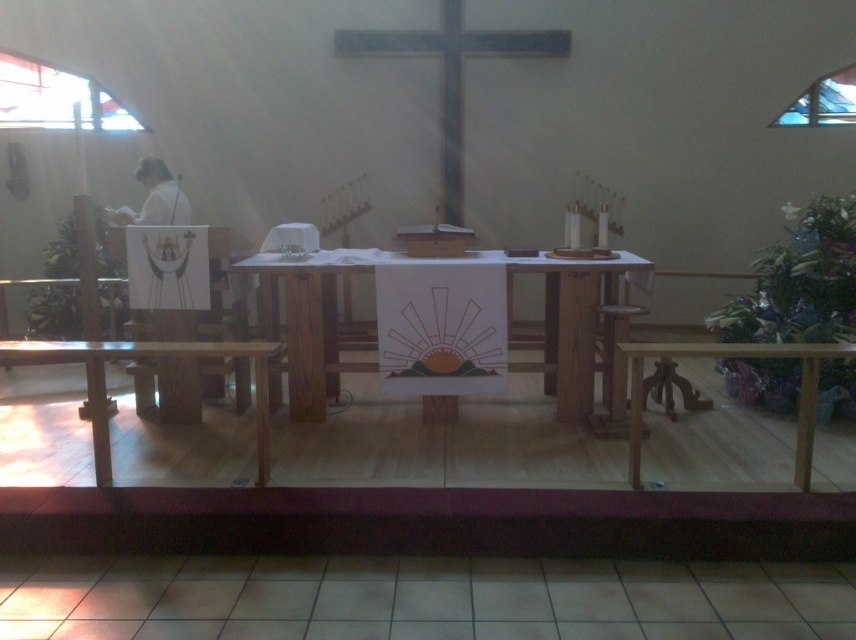
You are standing in the church and want to place a 3 meter long banner on the wooden table at lower right. Can you determine if the banner will fit on the table?

The wooden table at lower right is 2.95 meters from viewer, so the banner is slightly longer than the table. It may not fit properly and could hang over the edges.